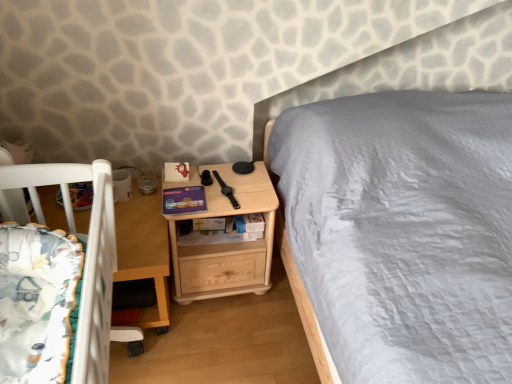
Find the location of a particular element. This screenshot has height=384, width=512. free point above light wood/texture nightstand at center (from a real-world perspective) is located at coordinates (208, 175).